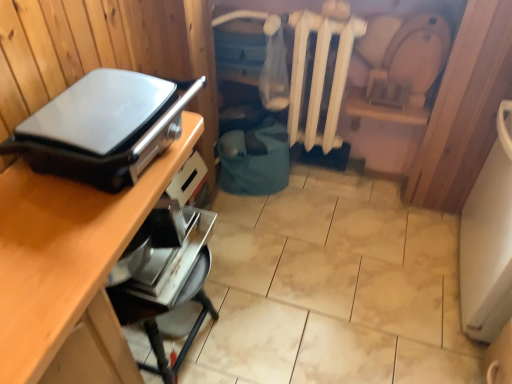
Question: Considering the positions of matte black appliance at left, which is the second appliance from bottom to top, and metallic silver toaster at lower center, marked as the 1th appliance in a bottom-to-top arrangement, in the image, is matte black appliance at left, which is the second appliance from bottom to top, wider or thinner than metallic silver toaster at lower center, marked as the 1th appliance in a bottom-to-top arrangement,?

Choices:
 (A) wide
 (B) thin

Answer: (A)

Question: Is matte black appliance at left, arranged as the first appliance when viewed from the top, inside the boundaries of metallic silver toaster at lower center, the 2th appliance positioned from the top, or outside?

Choices:
 (A) outside
 (B) inside

Answer: (A)

Question: Considering the real-world distances, which object is farthest from the white matte radiator at center?

Choices:
 (A) metallic silver toaster at lower center, marked as the 1th appliance in a bottom-to-top arrangement
 (B) wooden desk at upper left
 (C) matte black appliance at left, which is the second appliance from bottom to top

Answer: (B)

Question: Based on their relative distances, which object is farther from the metallic silver toaster at lower center, marked as the 1th appliance in a bottom-to-top arrangement?

Choices:
 (A) white matte radiator at center
 (B) matte black appliance at left, arranged as the first appliance when viewed from the top
 (C) wooden desk at upper left

Answer: (A)